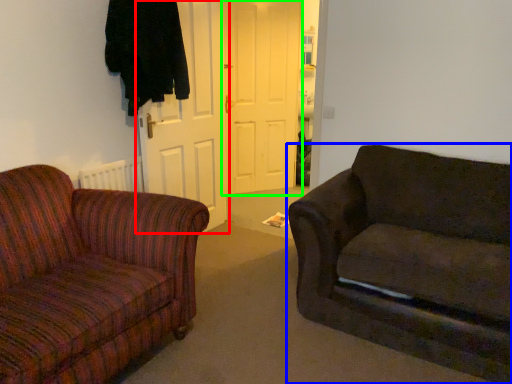
Question: Which object is positioned farthest from door (highlighted by a red box)? Select from studio couch (highlighted by a blue box) and door (highlighted by a green box).

Choices:
 (A) studio couch
 (B) door

Answer: (A)